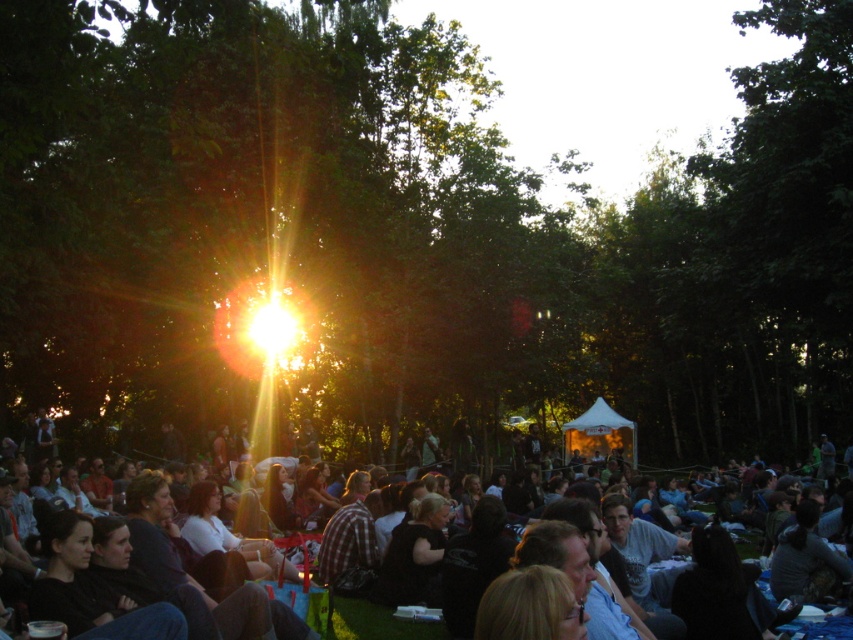
You are a performer preparing to set up a sound system for the event. You need to place the equipment between the green leafy tree at center and the dark clothing crowd at lower center. What is the minimum distance you should maintain between the equipment and the crowd to ensure it doesn

The distance between the green leafy tree at center and the dark clothing crowd at lower center is 14.44 meters. To ensure the equipment is placed safely between them, you should maintain at least half of that distance, so approximately 7.22 meters from the crowd.

You are a photographer trying to capture a clear shot of the dark clothing crowd at lower center. However, there is a green leafy tree at center in the way. Based on their heights, can you position yourself so that the crowd is visible above the tree?

The green leafy tree at center is taller than the dark clothing crowd at lower center, so positioning yourself to see the crowd above the tree would not be possible since the tree is taller.

You are standing at the point marked as point (403, 240) in the image. What object are you currently standing on?

You are standing on the green leafy tree at center.